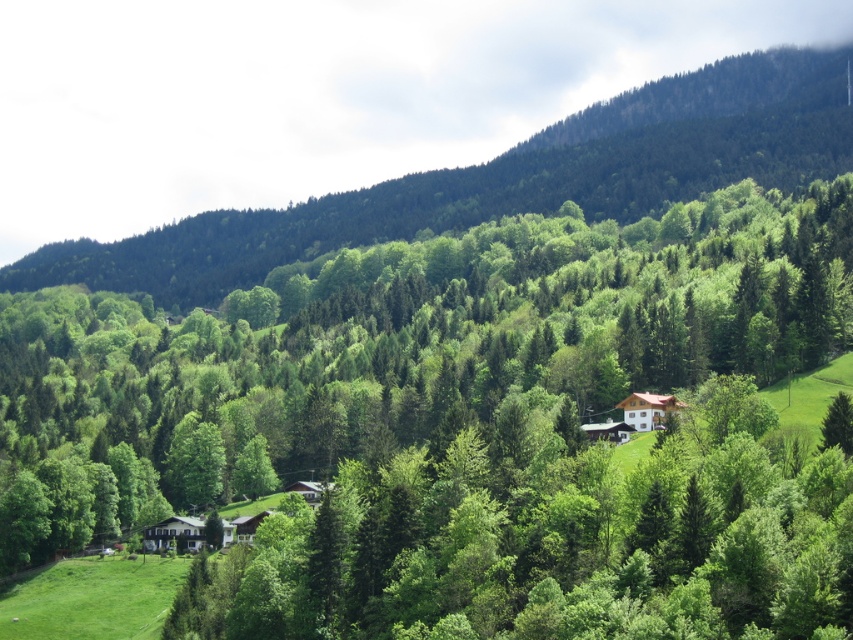
What do you see at coordinates (469, 429) in the screenshot?
I see `green leafy tree at center` at bounding box center [469, 429].

Is green leafy tree at center smaller than green forested mountain at upper center?

Yes.

Which is behind, point (726, 317) or point (723, 124)?

Positioned behind is point (723, 124).

Identify the location of green leafy tree at center. (469, 429).

Measure the distance between green leafy tree at center and camera.

green leafy tree at center is 59.97 meters from camera.

Can you confirm if green leafy tree at center is positioned to the right of green matte tree at center?

Indeed, green leafy tree at center is positioned on the right side of green matte tree at center.

Find the location of `green leafy tree at center`. green leafy tree at center is located at coordinates (469, 429).

Who is shorter, green forested mountain at upper center or green matte tree at center?

Standing shorter between the two is green matte tree at center.

Is green forested mountain at upper center closer to camera compared to green matte tree at center?

No, it is behind green matte tree at center.

Does point (360, 225) lie behind point (177, 456)?

Yes, it is behind point (177, 456).

The width and height of the screenshot is (853, 640). Identify the location of green forested mountain at upper center. (509, 179).